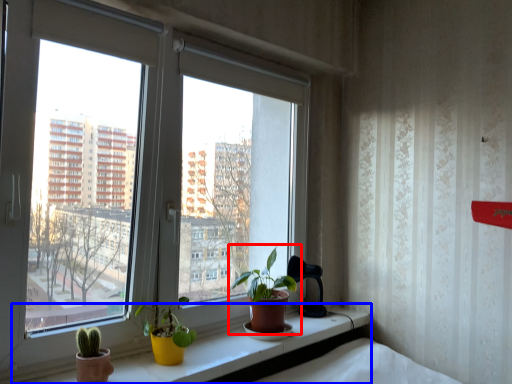
Question: Which point is closer to the camera, houseplant (highlighted by a red box) or window sill (highlighted by a blue box)?

Choices:
 (A) houseplant
 (B) window sill

Answer: (B)